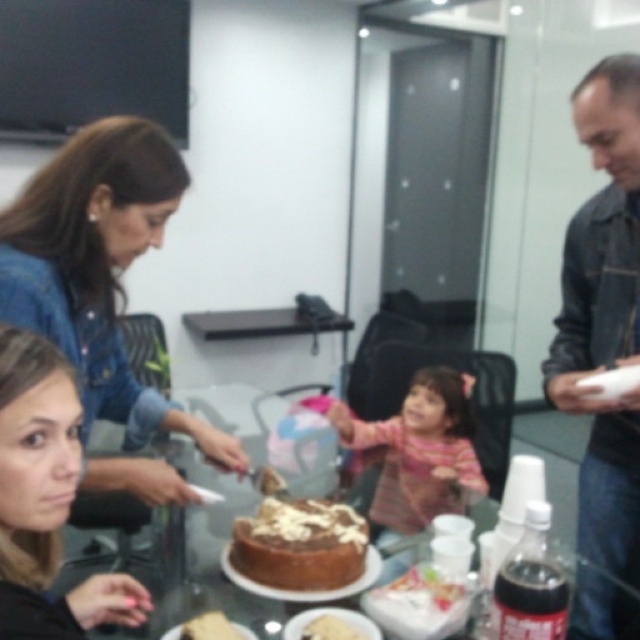
Which is behind, point (397, 496) or point (358, 637)?

Point (397, 496)

Between striped fabric at center and white creamy cake at center, which one appears on the right side from the viewer's perspective?

striped fabric at center is more to the right.

Is point (476, 468) positioned behind point (328, 616)?

That is True.

Locate an element on the screen. The height and width of the screenshot is (640, 640). striped fabric at center is located at coordinates (420, 451).

Which is above, denim jacket at upper right or chocolatesmoothcake at center?

denim jacket at upper right is higher up.

Is point (632, 340) closer to viewer compared to point (282, 561)?

No.

In the scene shown: Measure the distance between point (596, 321) and camera.

A distance of 4.89 feet exists between point (596, 321) and camera.

Locate an element on the screen. This screenshot has width=640, height=640. denim jacket at upper right is located at coordinates (604, 316).

Between denim jacket at upper left and smooth skin face at lower left, which one appears on the right side from the viewer's perspective?

smooth skin face at lower left is more to the right.

This screenshot has width=640, height=640. I want to click on denim jacket at upper left, so click(99, 268).